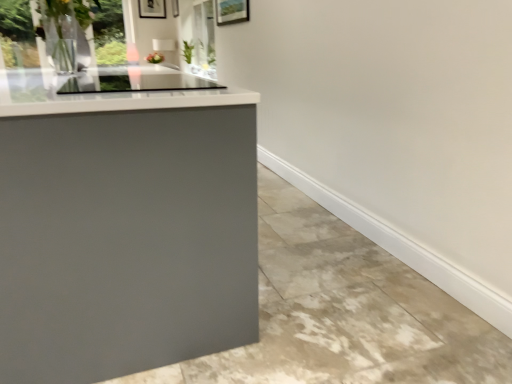
Question: From the image's perspective, is matte gray concrete at lower left positioned above or below metallic silver picture frame at upper center, acting as the second picture frame starting from the left?

Choices:
 (A) below
 (B) above

Answer: (A)

Question: Considering the positions of matte gray concrete at lower left and metallic silver picture frame at upper center, acting as the second picture frame starting from the left, in the image, is matte gray concrete at lower left taller or shorter than metallic silver picture frame at upper center, acting as the second picture frame starting from the left,?

Choices:
 (A) tall
 (B) short

Answer: (B)

Question: Considering the real-world distances, which object is closest to the metallic silver picture frame at upper center, acting as the second picture frame starting from the left?

Choices:
 (A) matte black picture frame at upper center, the first picture frame when ordered from left to right
 (B) matte gray concrete at lower left
 (C) transparent glass window at upper left

Answer: (A)

Question: Estimate the real-world distances between objects in this image. Which object is closer to the metallic silver picture frame at upper center, acting as the second picture frame starting from the left?

Choices:
 (A) matte black picture frame at upper center, arranged as the 2th picture frame when viewed from the right
 (B) transparent glass window at upper left
 (C) matte gray concrete at lower left

Answer: (A)